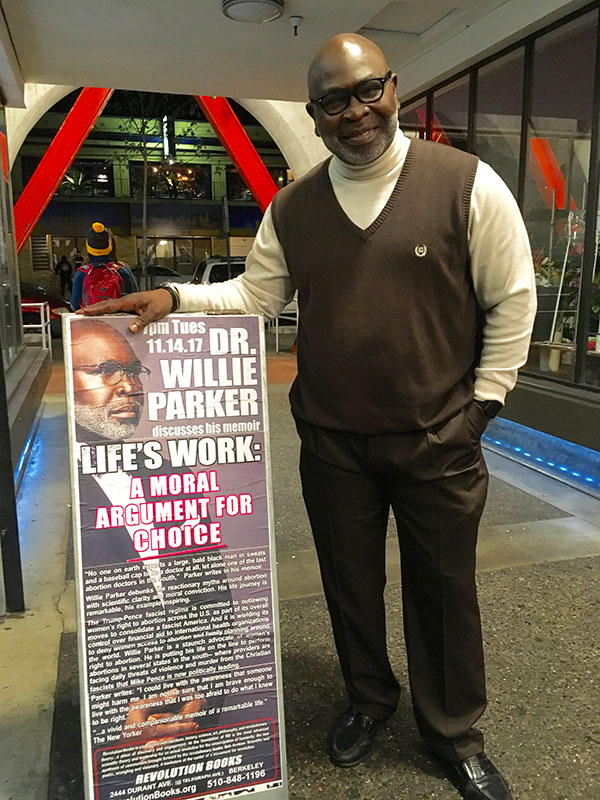
In order to click on windows in this screenshot , I will do `click(550, 158)`, `click(12, 304)`.